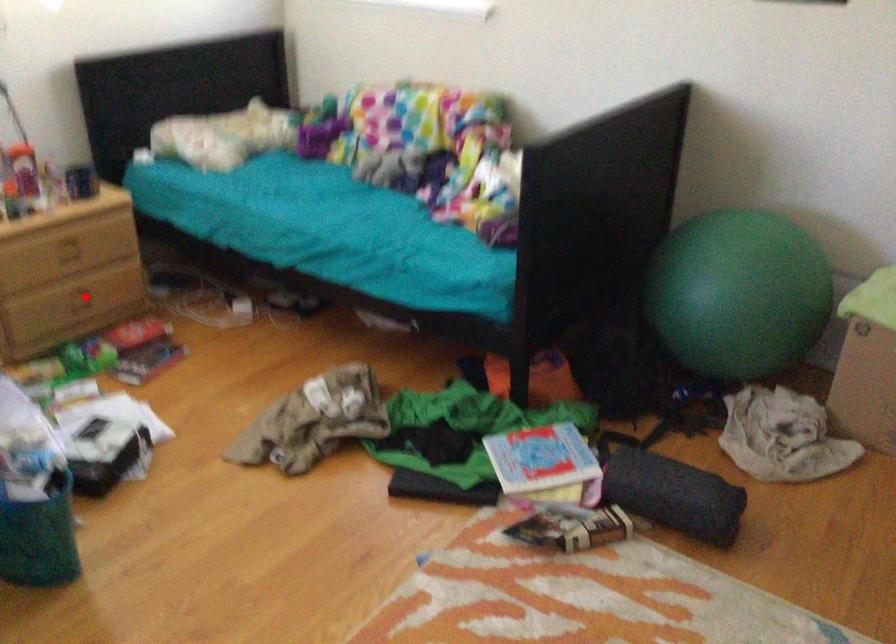
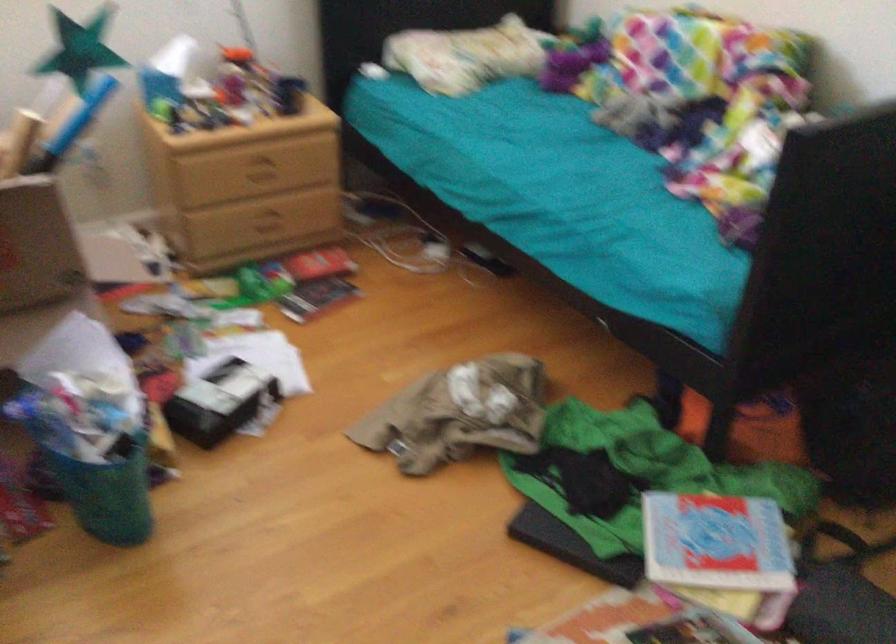
Locate, in the second image, the point that corresponds to the highlighted location in the first image.

(268, 222)